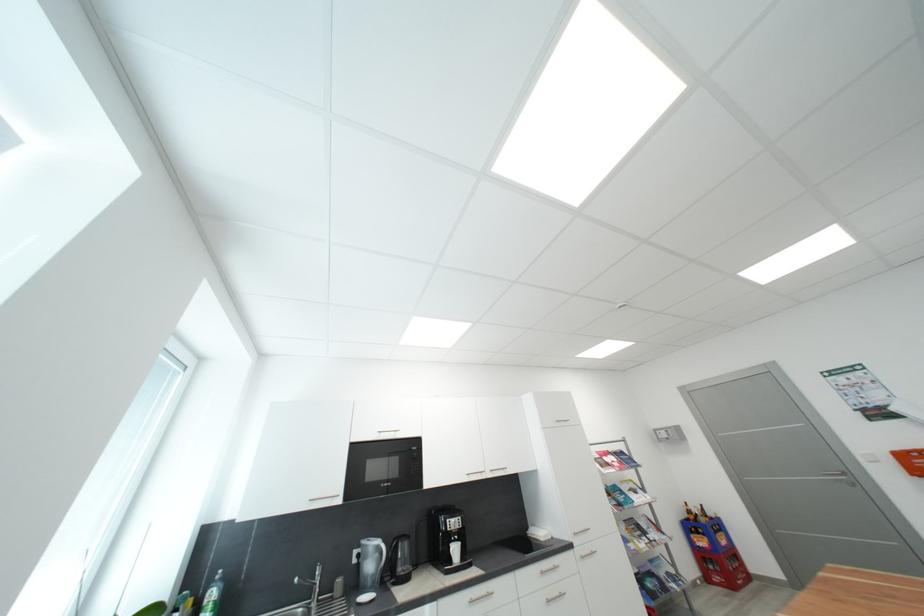
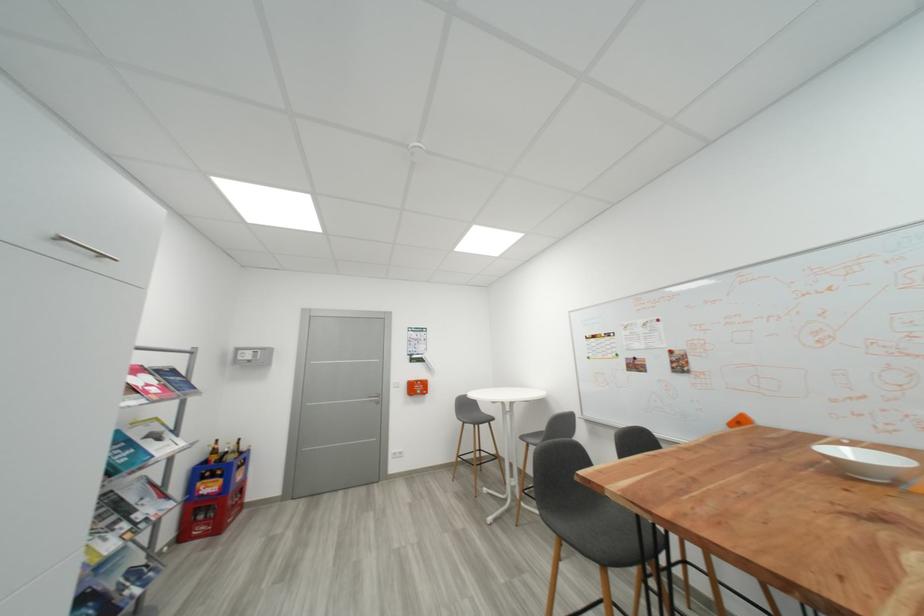
Where in the second image is the point corresponding to (x=697, y=514) from the first image?

(223, 454)